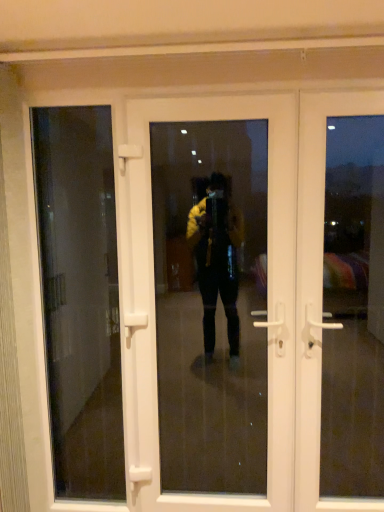
Find the location of `empty space that is ontop of white plastic door at center, the 2th door positioned from the right (from a real-world perspective)`. empty space that is ontop of white plastic door at center, the 2th door positioned from the right (from a real-world perspective) is located at coordinates (199, 91).